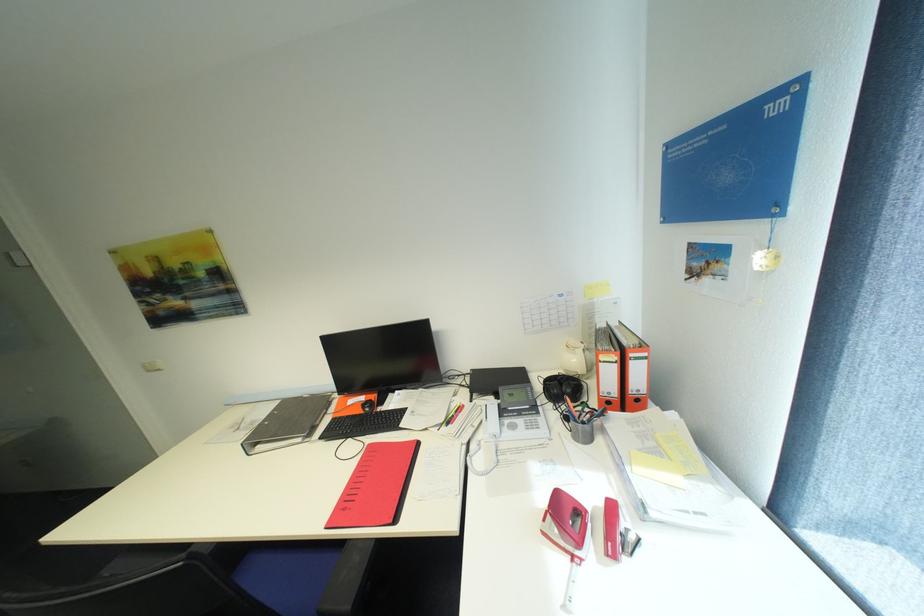
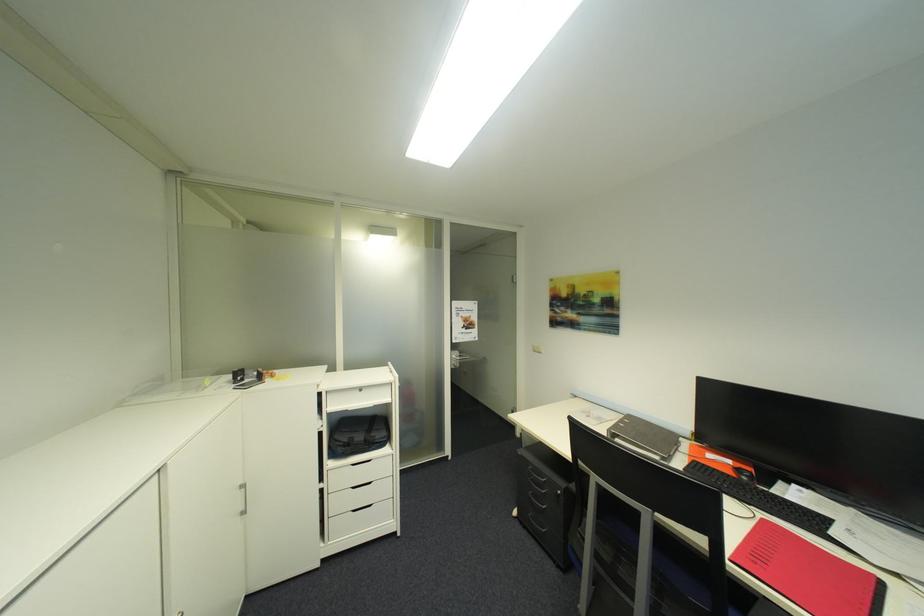
The point at (367, 458) is marked in the first image. Where is the corresponding point in the second image?

(760, 524)